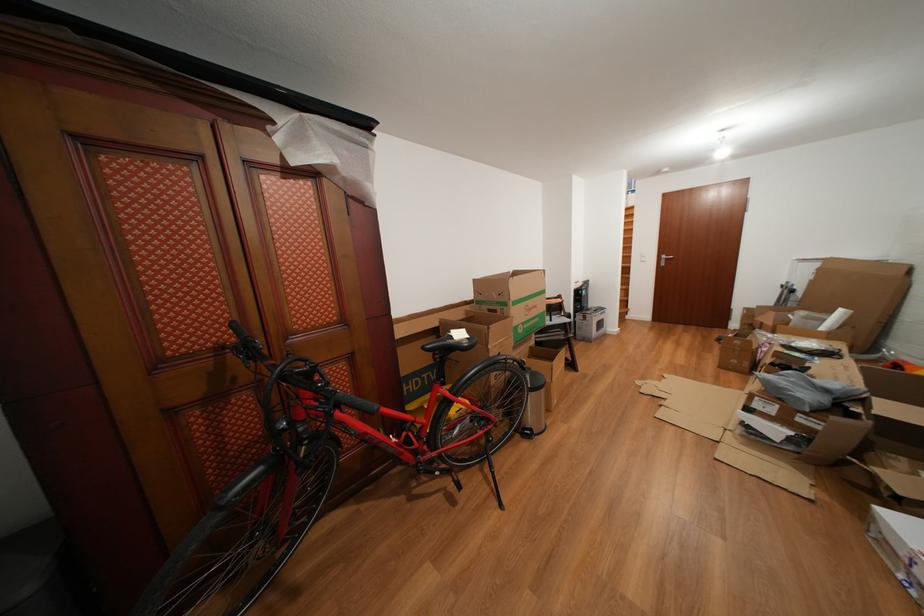
The image size is (924, 616). In order to click on chair sitting surface in this screenshot , I will do `click(558, 342)`.